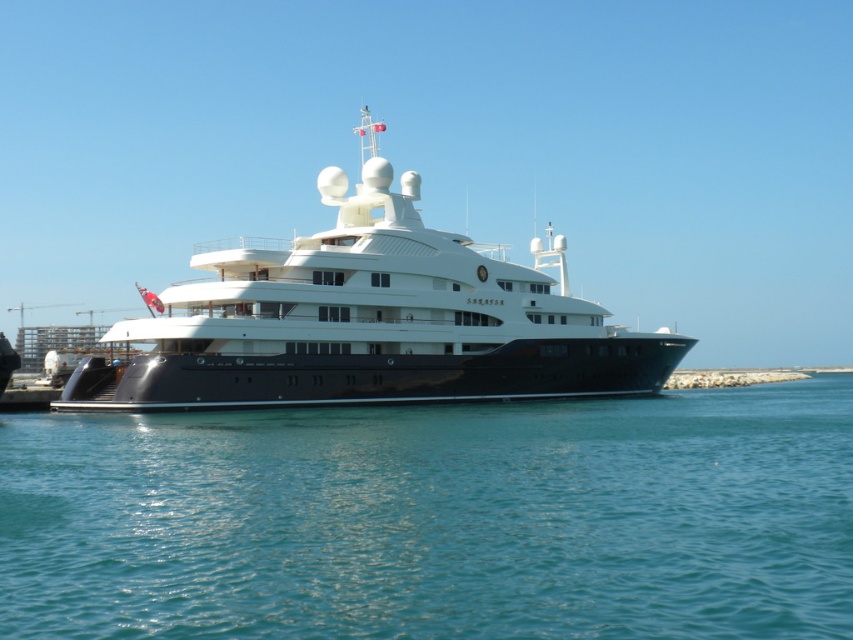
Between point (334, 515) and point (109, 364), which one is positioned in front?

Point (334, 515)

Does blue water at lower center lie in front of shiny white cruise ship at center?

Yes, it is.

Does point (257, 570) lie behind point (505, 344)?

No, (257, 570) is closer to viewer.

Locate an element on the screen. This screenshot has width=853, height=640. blue water at lower center is located at coordinates point(436,518).